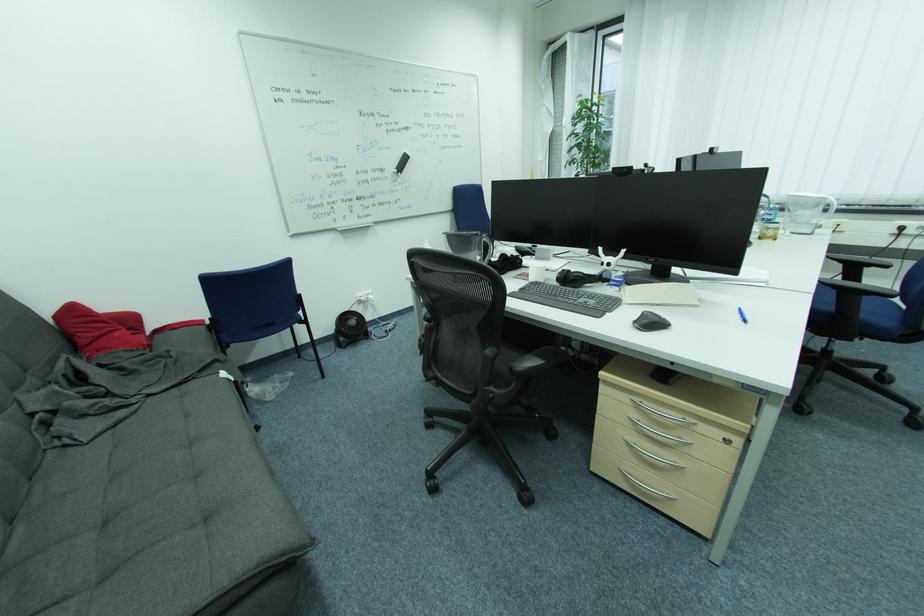
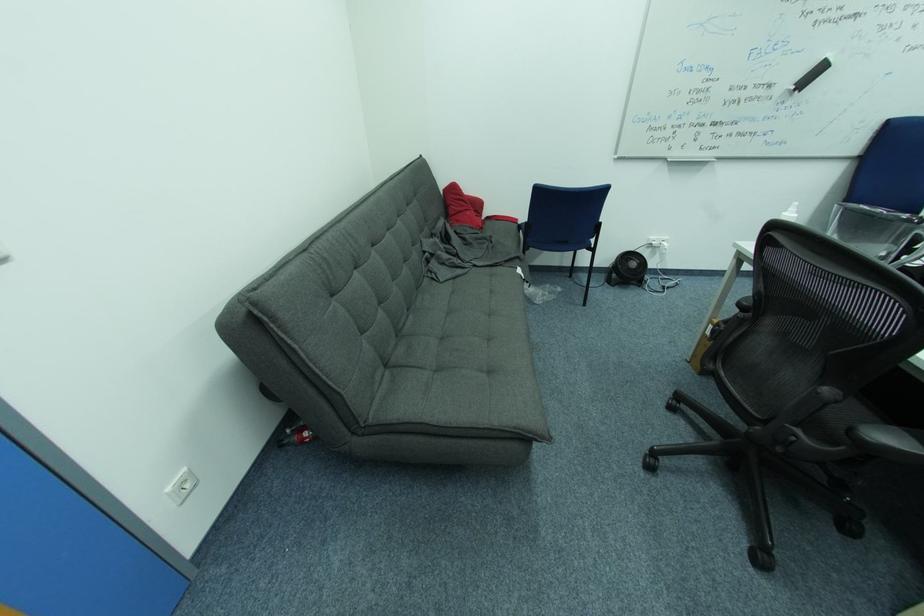
The point at (x=79, y=310) is marked in the first image. Where is the corresponding point in the second image?

(459, 188)